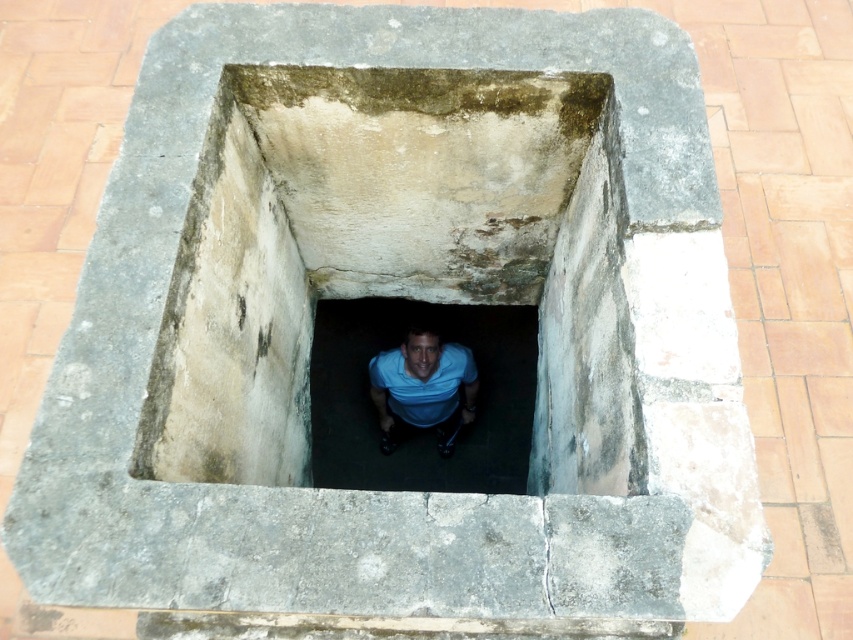
You are a rescue worker assessing the situation of a person trapped in a well. You see the blue fabric man at center and the blue matte shirt at center. Which object is wider?

The blue fabric man at center might be wider than the blue matte shirt at center.

You are standing near the concrete well at center and the blue matte shirt at center. Which object is closer to you?

The concrete well at center is closer to you because it is in front of the blue matte shirt at center.